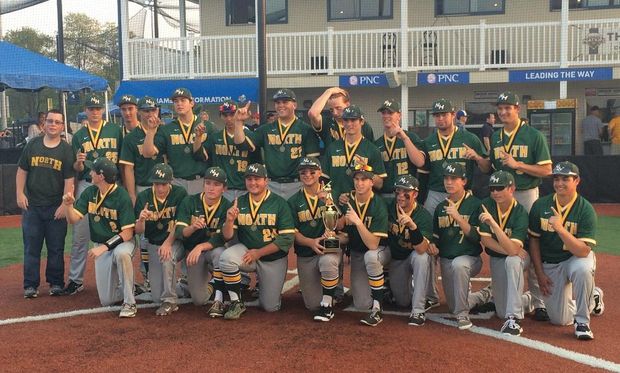
The height and width of the screenshot is (373, 620). In order to click on windows in this screenshot , I will do `click(242, 9)`, `click(275, 5)`, `click(346, 6)`, `click(453, 4)`.